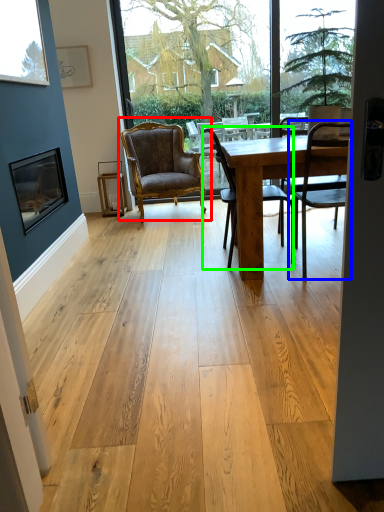
Question: Which is farther away from chair (highlighted by a red box)? chair (highlighted by a blue box) or chair (highlighted by a green box)?

Choices:
 (A) chair
 (B) chair

Answer: (A)